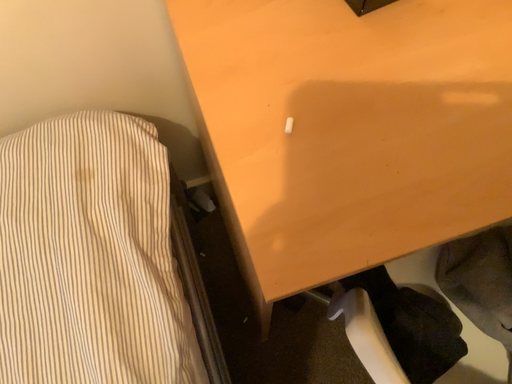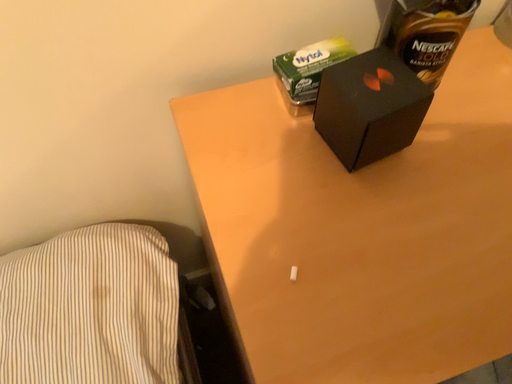
Question: Which way did the camera rotate in the video?

Choices:
 (A) rotated upward
 (B) rotated downward

Answer: (A)